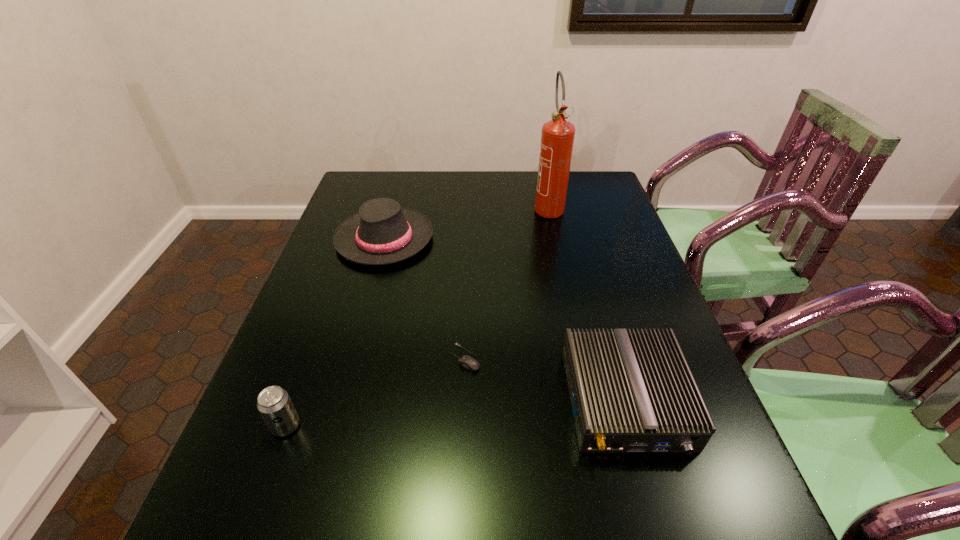
Locate which object ranks second in proximity to the router. Please provide its 2D coordinates. Your answer should be formatted as a tuple, i.e. [(x, y)], where the tuple contains the x and y coordinates of a point satisfying the conditions above.

[(382, 232)]

Locate an element on the screen. The width and height of the screenshot is (960, 540). free space that satisfies the following two spatial constraints: 1. on the back side of the beer can; 2. on the right side of the dress hat is located at coordinates (354, 239).